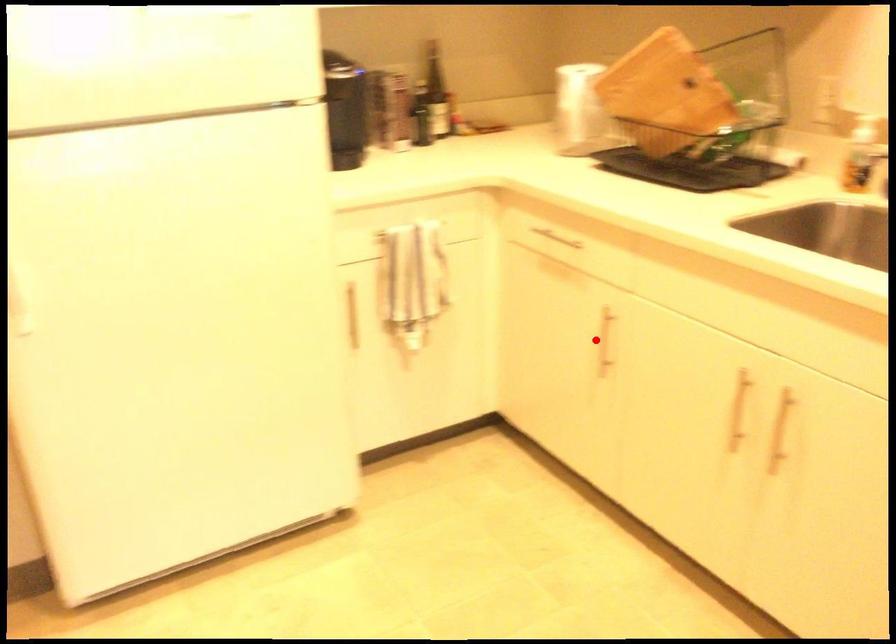
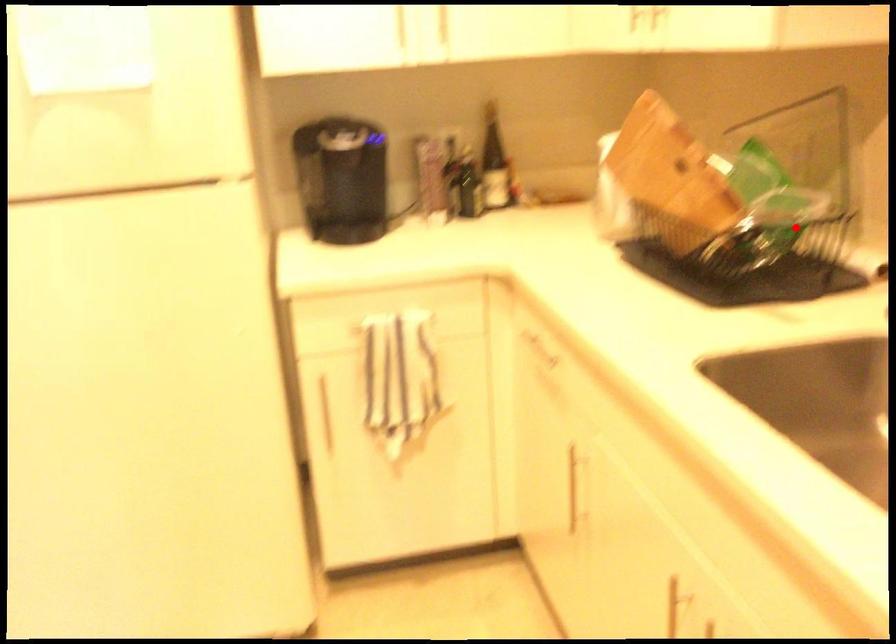
I am providing you with two images of the same scene from different viewpoints. A red point is marked on the first image and another point is marked on the second image. Does the point marked in image1 correspond to the same location as the one in image2?

No